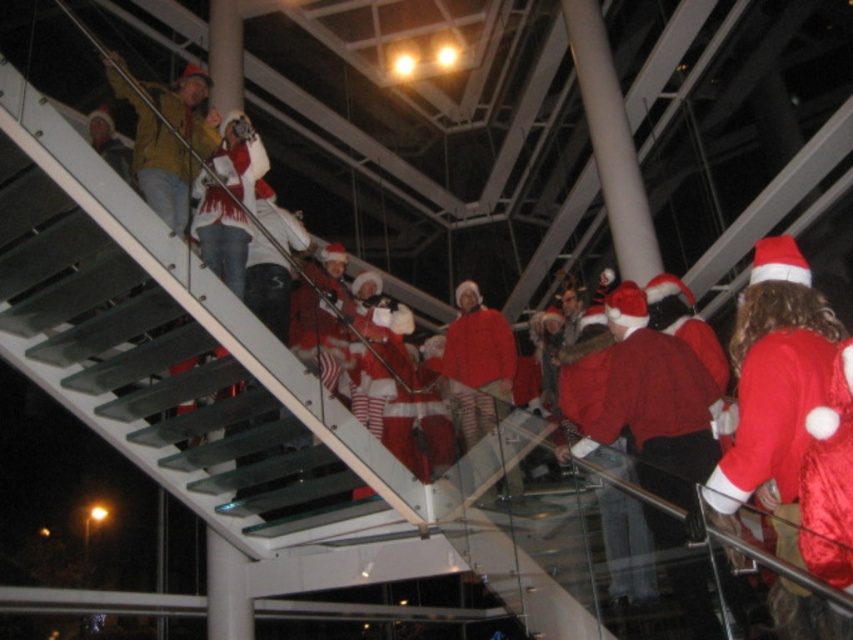
Measure the distance between red satin santa at right and yellow matte jacket at upper left.

red satin santa at right and yellow matte jacket at upper left are 13.09 feet apart.

Is red satin santa at right to the left of yellow matte jacket at upper left from the viewer's perspective?

Incorrect, red satin santa at right is not on the left side of yellow matte jacket at upper left.

Is point (837, 332) closer to viewer compared to point (207, 86)?

Yes, it is.

This screenshot has width=853, height=640. Find the location of `red satin santa at right`. red satin santa at right is located at coordinates (775, 390).